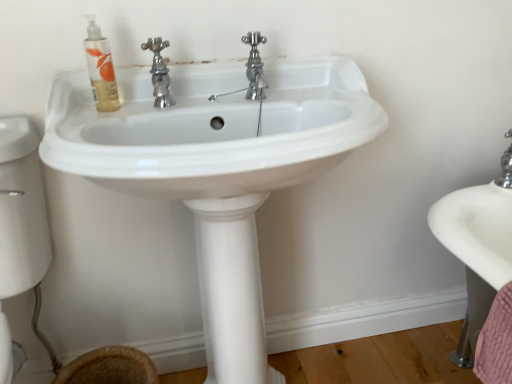
Question: Is brown woven basket at lower left positioned behind white glossy sink at center?

Choices:
 (A) no
 (B) yes

Answer: (B)

Question: From the image's perspective, is brown woven basket at lower left under white glossy sink at center?

Choices:
 (A) yes
 (B) no

Answer: (A)

Question: Is white glossy sink at center at the back of brown woven basket at lower left?

Choices:
 (A) yes
 (B) no

Answer: (A)

Question: Considering the relative sizes of brown woven basket at lower left and white glossy sink at center in the image provided, is brown woven basket at lower left smaller than white glossy sink at center?

Choices:
 (A) yes
 (B) no

Answer: (A)

Question: From a real-world perspective, is brown woven basket at lower left under white glossy sink at center?

Choices:
 (A) yes
 (B) no

Answer: (A)

Question: Based on their sizes in the image, would you say brown woven basket at lower left is bigger or smaller than white glossy sink at center?

Choices:
 (A) small
 (B) big

Answer: (A)

Question: From their relative heights in the image, would you say brown woven basket at lower left is taller or shorter than white glossy sink at center?

Choices:
 (A) short
 (B) tall

Answer: (A)

Question: Is brown woven basket at lower left spatially inside white glossy sink at center, or outside of it?

Choices:
 (A) inside
 (B) outside

Answer: (A)

Question: From a real-world perspective, is brown woven basket at lower left above or below white glossy sink at center?

Choices:
 (A) below
 (B) above

Answer: (A)

Question: Considering the positions of white glossy sink at center and brown woven basket at lower left in the image, is white glossy sink at center taller or shorter than brown woven basket at lower left?

Choices:
 (A) tall
 (B) short

Answer: (A)

Question: From a real-world perspective, is white glossy sink at center positioned above or below brown woven basket at lower left?

Choices:
 (A) below
 (B) above

Answer: (B)

Question: From the image's perspective, is white glossy sink at center located above or below brown woven basket at lower left?

Choices:
 (A) below
 (B) above

Answer: (B)

Question: Considering the positions of white glossy sink at center and brown woven basket at lower left in the image, is white glossy sink at center wider or thinner than brown woven basket at lower left?

Choices:
 (A) wide
 (B) thin

Answer: (A)

Question: Based on their positions, is brown woven basket at lower left located to the left or right of translucent gel mouthwash at upper left?

Choices:
 (A) left
 (B) right

Answer: (A)

Question: Considering their positions, is brown woven basket at lower left located in front of or behind translucent gel mouthwash at upper left?

Choices:
 (A) front
 (B) behind

Answer: (B)